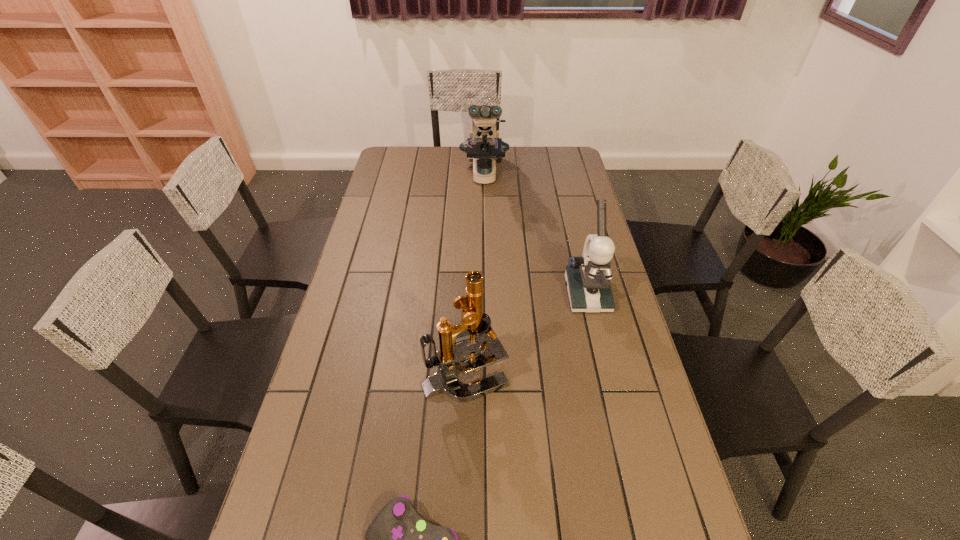
Identify the location of vacant space at the left edge of the desktop. pos(385,204).

This screenshot has height=540, width=960. In the image, there is a desktop. What are the coordinates of `vacant region at the right edge` in the screenshot? It's located at (604, 371).

This screenshot has height=540, width=960. I want to click on vacant space at the far left corner of the desktop, so click(x=398, y=157).

Where is `blank region between the second nearest object and the rightmost object`? The width and height of the screenshot is (960, 540). blank region between the second nearest object and the rightmost object is located at coordinates (526, 333).

I want to click on free space between the second farthest object and the second nearest object, so click(x=526, y=333).

Locate an element on the screen. The height and width of the screenshot is (540, 960). vacant point located between the third farthest object and the rightmost object is located at coordinates (526, 333).

Identify the location of object identified as the second closest to the farthest microscope. (475, 326).

The width and height of the screenshot is (960, 540). Find the location of `object that ranks as the second closest to the control`. object that ranks as the second closest to the control is located at coordinates (588, 277).

Find the location of `microscope that stands as the second closest to the control`. microscope that stands as the second closest to the control is located at coordinates (588, 277).

Identify the location of microscope that is the second closest to the farthest microscope. This screenshot has width=960, height=540. (475, 326).